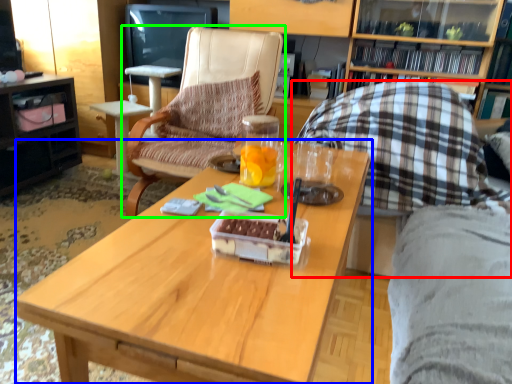
Question: Estimate the real-world distances between objects in this image. Which object is closer to chair (highlighted by a red box), coffee table (highlighted by a blue box) or chair (highlighted by a green box)?

Choices:
 (A) coffee table
 (B) chair

Answer: (A)